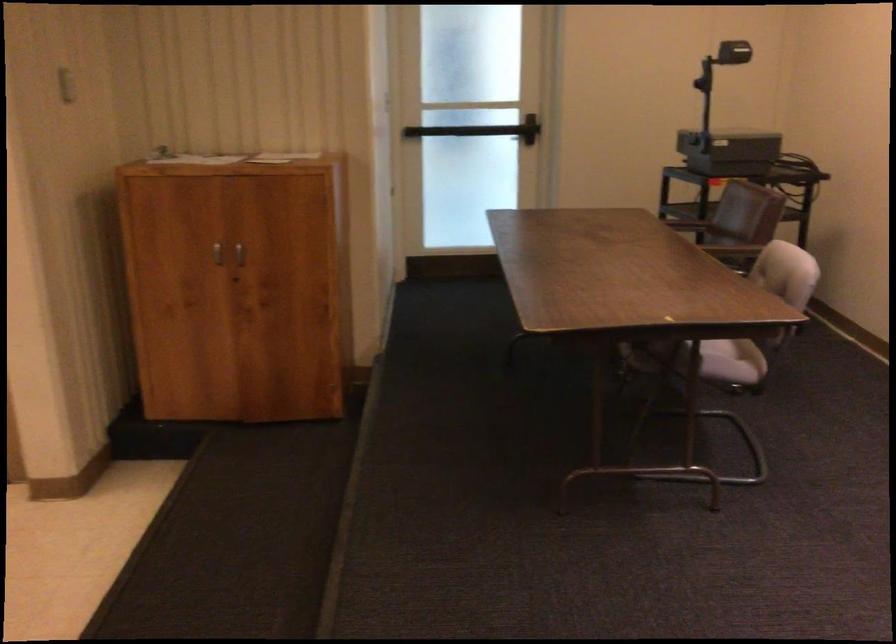
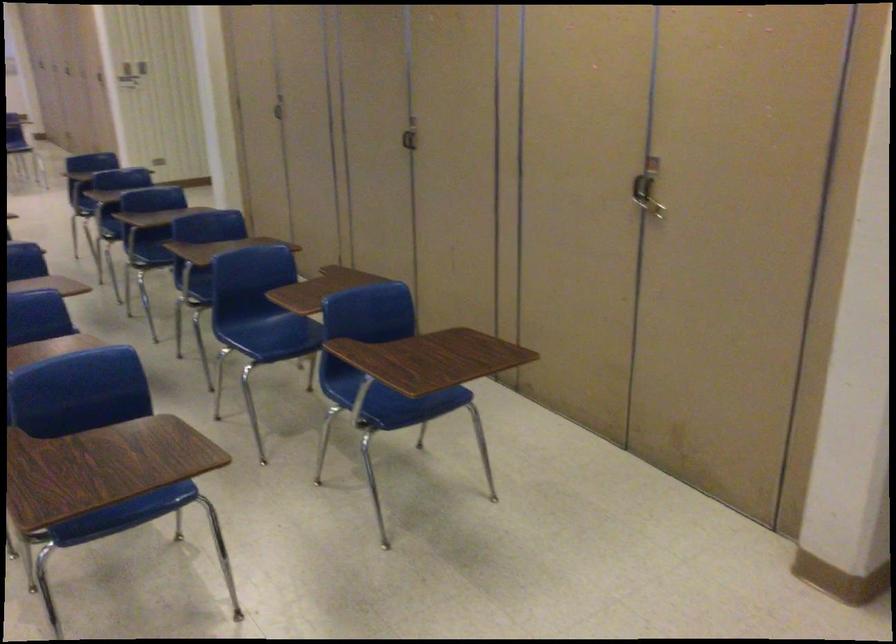
Question: The camera is either moving clockwise (left) or counter-clockwise (right) around the object. The first image is from the beginning of the video and the second image is from the end. Is the camera moving left or right when shooting the video?

Choices:
 (A) Left
 (B) Right

Answer: (B)